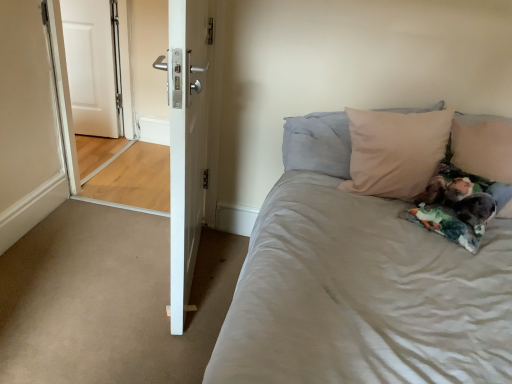
Question: From the image's perspective, relative to white matte door at left, the 2th door in the right-to-left sequence, is white glossy door at center, the first door when ordered from right to left, above or below?

Choices:
 (A) above
 (B) below

Answer: (B)

Question: Considering the positions of white glossy door at center, positioned as the 1th door in front-to-back order, and white matte door at left, the 2th door in the right-to-left sequence, in the image, is white glossy door at center, positioned as the 1th door in front-to-back order, wider or thinner than white matte door at left, the 2th door in the right-to-left sequence,?

Choices:
 (A) thin
 (B) wide

Answer: (B)

Question: Estimate the real-world distances between objects in this image. Which object is farther from the beige fabric pillow at upper right, placed as the second pillow when sorted from right to left?

Choices:
 (A) white glossy door at center, which is counted as the 2th door, starting from the back
 (B) beige fabric pillow at upper right, the 1th pillow from the right
 (C) white matte door at left, the second door when ordered from front to back
 (D) white glossy door at left

Answer: (C)

Question: Which is farther from the beige fabric pillow at upper right, the second pillow when ordered from left to right?

Choices:
 (A) white glossy door at left
 (B) white glossy door at center, the first door when ordered from right to left
 (C) beige fabric pillow at upper right, which is the 1th pillow in left-to-right order
 (D) white matte door at left, which ranks as the 1th door in back-to-front order

Answer: (D)